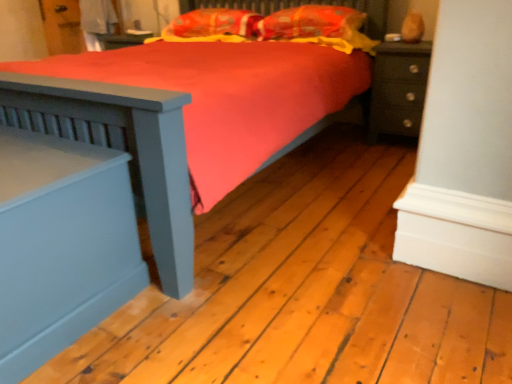
Question: In terms of width, does orange fabric pillow at upper center, which appears as the 2th pillow when viewed from the right, look wider or thinner when compared to matte dark green nightstand at right, the first nightstand from the top?

Choices:
 (A) thin
 (B) wide

Answer: (B)

Question: In terms of size, does orange fabric pillow at upper center, which appears as the 2th pillow when viewed from the right, appear bigger or smaller than matte dark green nightstand at right, which is the second nightstand in front-to-back order?

Choices:
 (A) small
 (B) big

Answer: (A)

Question: Considering the real-world distances, which object is farthest from the orange fabric pillow at upper center, arranged as the 1th pillow when viewed from the right?

Choices:
 (A) orange fabric pillow at upper center, which appears as the 2th pillow when viewed from the right
 (B) matte dark green nightstand at right, the 1th nightstand from the back
 (C) matte blue nightstand at left, acting as the 2th nightstand starting from the right

Answer: (C)

Question: Based on their relative distances, which object is farther from the matte blue nightstand at left, the 2th nightstand when ordered from top to bottom?

Choices:
 (A) orange fabric pillow at upper center, which is counted as the second pillow, starting from the left
 (B) matte dark green nightstand at right, which is the second nightstand from left to right
 (C) orange fabric pillow at upper center, which appears as the 2th pillow when viewed from the right

Answer: (B)